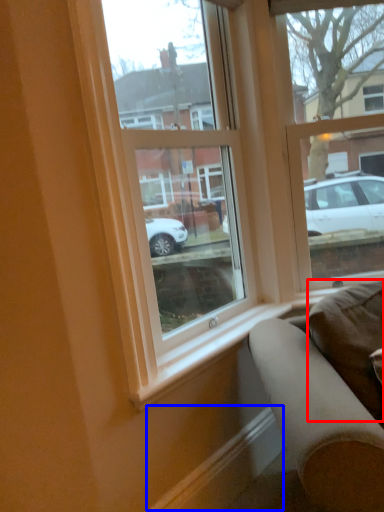
Question: Which of the following is the closest to the observer, pillow (highlighted by a red box) or curb (highlighted by a blue box)?

Choices:
 (A) pillow
 (B) curb

Answer: (A)